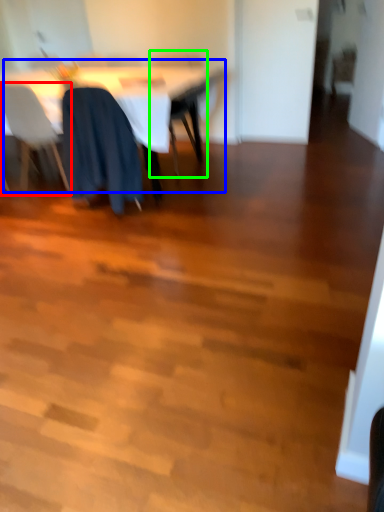
Question: Estimate the real-world distances between objects in this image. Which object is closer to chair (highlighted by a red box), table (highlighted by a blue box) or chair (highlighted by a green box)?

Choices:
 (A) table
 (B) chair

Answer: (A)